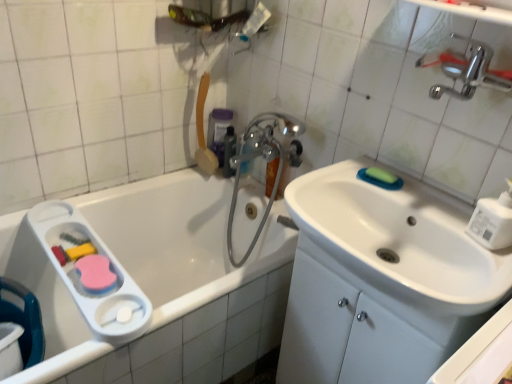
Question: Is purple plastic mouthwash at upper center, the second mouthwash when ordered from front to back, bigger than white plastic soap dispenser at right?

Choices:
 (A) no
 (B) yes

Answer: (B)

Question: Would you say purple plastic mouthwash at upper center, positioned as the 1th mouthwash in back-to-front order, is outside white plastic soap dispenser at right?

Choices:
 (A) yes
 (B) no

Answer: (A)

Question: Does purple plastic mouthwash at upper center, positioned as the 1th mouthwash in back-to-front order, come behind white plastic soap dispenser at right?

Choices:
 (A) yes
 (B) no

Answer: (A)

Question: Considering the relative sizes of purple plastic mouthwash at upper center, the second mouthwash when ordered from front to back, and white plastic soap dispenser at right in the image provided, is purple plastic mouthwash at upper center, the second mouthwash when ordered from front to back, shorter than white plastic soap dispenser at right?

Choices:
 (A) yes
 (B) no

Answer: (B)

Question: Considering the relative sizes of purple plastic mouthwash at upper center, positioned as the 1th mouthwash in back-to-front order, and white plastic soap dispenser at right in the image provided, is purple plastic mouthwash at upper center, positioned as the 1th mouthwash in back-to-front order, smaller than white plastic soap dispenser at right?

Choices:
 (A) no
 (B) yes

Answer: (A)

Question: Is purple plastic mouthwash at upper center, positioned as the 1th mouthwash in back-to-front order, facing away from white plastic soap dispenser at right?

Choices:
 (A) no
 (B) yes

Answer: (A)

Question: Could you tell me if polished chrome faucet at upper right is turned towards chrome metallic faucet at upper center?

Choices:
 (A) yes
 (B) no

Answer: (B)

Question: Is polished chrome faucet at upper right taller than chrome metallic faucet at upper center?

Choices:
 (A) no
 (B) yes

Answer: (A)

Question: Considering the relative sizes of polished chrome faucet at upper right and chrome metallic faucet at upper center in the image provided, is polished chrome faucet at upper right thinner than chrome metallic faucet at upper center?

Choices:
 (A) no
 (B) yes

Answer: (B)

Question: Can you confirm if polished chrome faucet at upper right is bigger than chrome metallic faucet at upper center?

Choices:
 (A) yes
 (B) no

Answer: (B)

Question: Considering the relative positions of polished chrome faucet at upper right and chrome metallic faucet at upper center in the image provided, is polished chrome faucet at upper right in front of chrome metallic faucet at upper center?

Choices:
 (A) yes
 (B) no

Answer: (A)

Question: Is polished chrome faucet at upper right to the right of chrome metallic faucet at upper center from the viewer's perspective?

Choices:
 (A) no
 (B) yes

Answer: (B)

Question: Can you confirm if chrome metallic faucet at upper center is positioned to the left of semi-transparent plastic bottle at upper center, which ranks as the first mouthwash in front-to-back order?

Choices:
 (A) no
 (B) yes

Answer: (A)